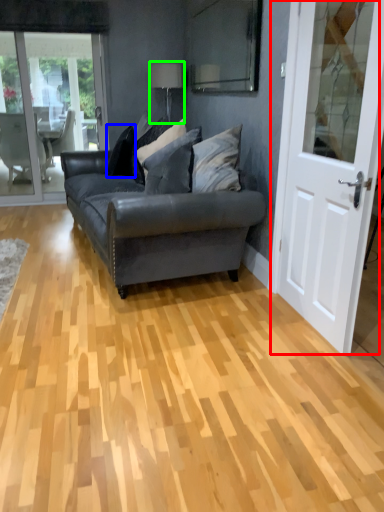
Question: Which object is the closest to the door (highlighted by a red box)? Choose among these: pillow (highlighted by a blue box) or lamp (highlighted by a green box).

Choices:
 (A) pillow
 (B) lamp

Answer: (A)